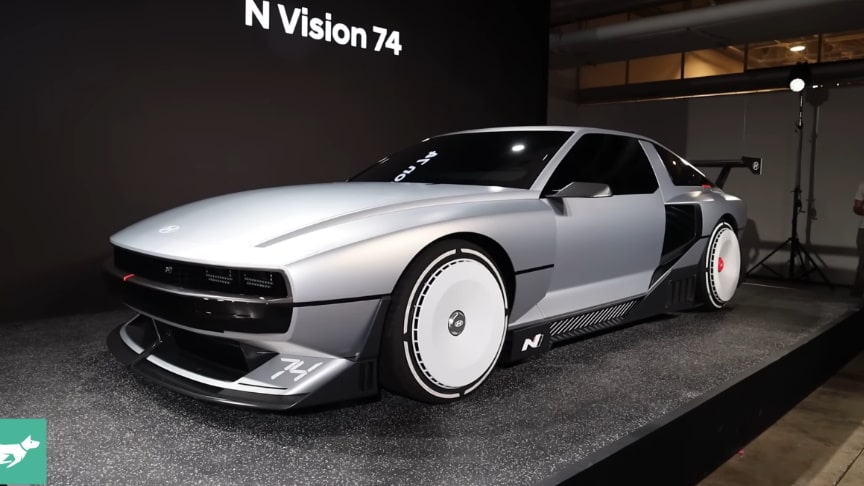
Where is `black wall`? Image resolution: width=864 pixels, height=486 pixels. black wall is located at coordinates (35, 199).